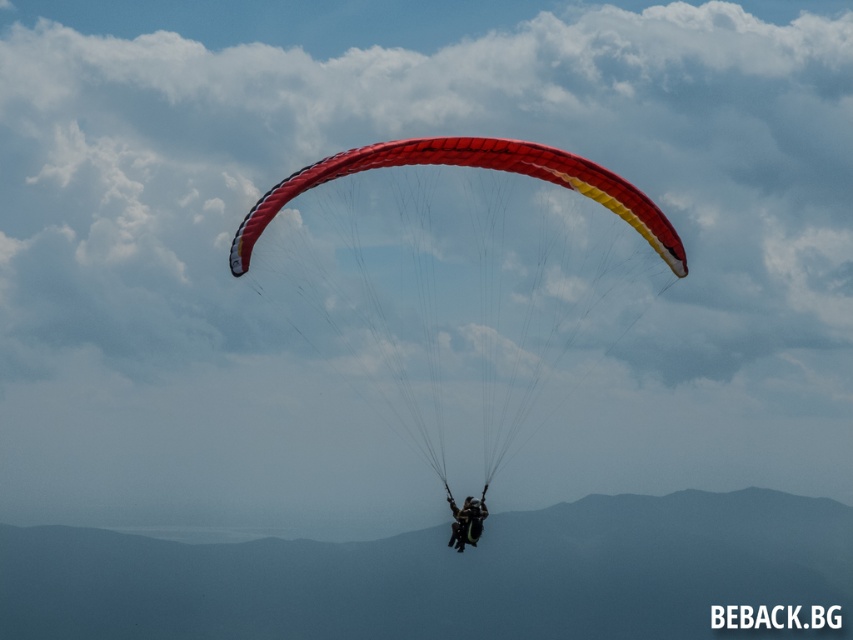
Does red fabric parachute at center have a larger size compared to black fabric parachute at center?

Yes.

Find the location of a particular element. red fabric parachute at center is located at coordinates (457, 280).